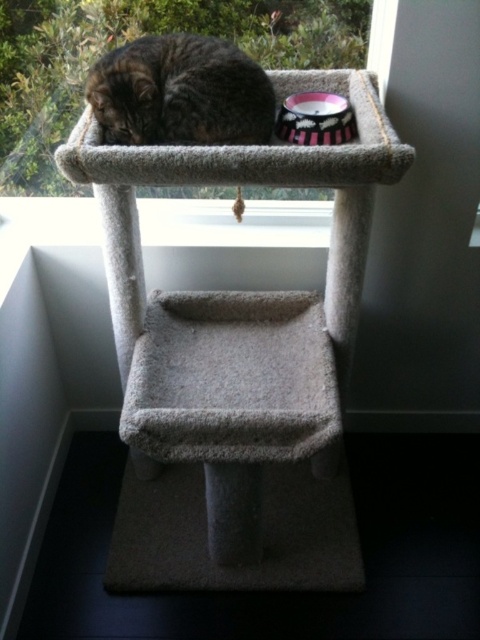
You are a cat owner who wants to ensure your cat stays warm during a cold winter night. The tabby fur cat at upper center is currently sleeping on the cat tree. Can the cat see the clear glass window at upper center from its current position?

The clear glass window at upper center is above the tabby fur cat at upper center, so the cat can see the window from its current position on the cat tree.

You are a cat trying to reach the top of the cat tree. You are currently at point (117, 97). Which direction should you move to get to point (52, 132)?

Point (52, 132) is behind point (117, 97), so you should move backward to reach it.